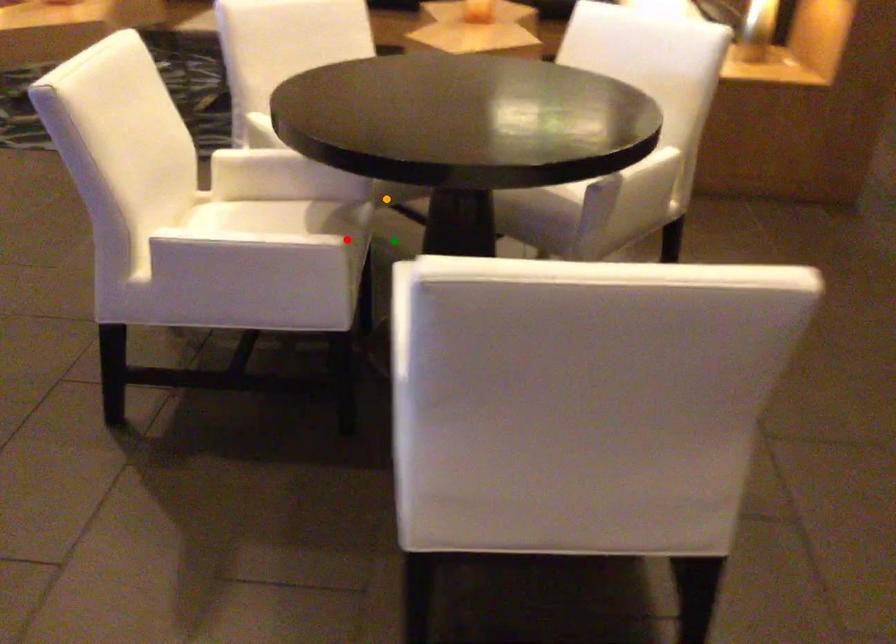
Order these from nearest to farthest:
1. orange point
2. red point
3. green point

red point, orange point, green point